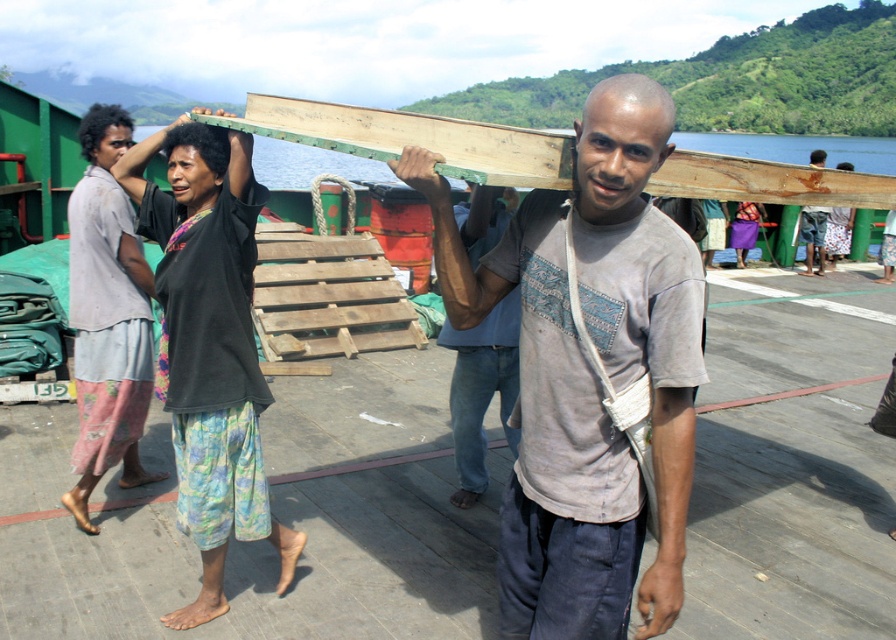
You are a photographer taking a picture of two people carrying wooden planks. You notice the matte gray shirt at center and the gray cotton shirt at center. Which one is positioned to the right side of the other?

The matte gray shirt at center is positioned to the right of the gray cotton shirt at center.

You are a photographer trying to capture both the matte gray shirt at center and the black cotton shirt at upper center in a single frame. Based on their sizes, which one would appear closer to the camera?

The matte gray shirt at center appears smaller in size compared to the black cotton shirt at upper center. Since smaller objects in a photo typically appear farther away due to perspective, the matte gray shirt at center would likely be farther from the camera, making the black cotton shirt at upper center closer to the camera.

You are a photographer standing at the camera position. You want to take a closeup photo of the matte gray shirt at center. Can you estimate how far you need to move forward to get the subject within your camera frame?

The matte gray shirt at center is 1.72 meters from camera, so you need to move forward approximately 1.72 meters to get it within the camera frame.